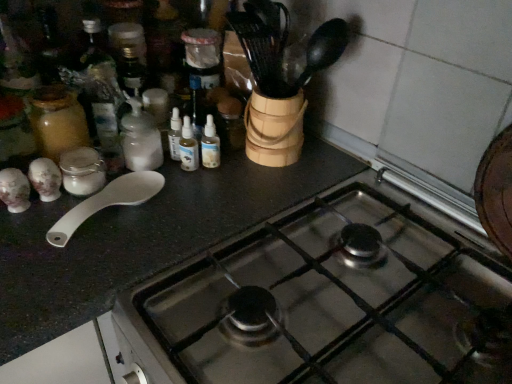
Where is `white plastic spoon at left`? This screenshot has height=384, width=512. white plastic spoon at left is located at coordinates (106, 202).

Where is `stainless steel gas stove at center`? stainless steel gas stove at center is located at coordinates (326, 304).

Is stainless steel gas stove at center positioned far away from white plastic spoon at left?

No, stainless steel gas stove at center is in close proximity to white plastic spoon at left.

From a real-world perspective, is stainless steel gas stove at center under white plastic spoon at left?

Yes.

Is stainless steel gas stove at center inside the boundaries of white plastic spoon at left, or outside?

stainless steel gas stove at center is located beyond the bounds of white plastic spoon at left.

Does stainless steel gas stove at center come behind white plastic spoon at left?

No, stainless steel gas stove at center is in front of white plastic spoon at left.

Does white plastic spoon at left have a greater width compared to stainless steel gas stove at center?

Incorrect, the width of white plastic spoon at left does not surpass that of stainless steel gas stove at center.

Is white plastic spoon at left touching stainless steel gas stove at center?

No, white plastic spoon at left is not next to stainless steel gas stove at center.

Is white plastic spoon at left completely or partially outside of stainless steel gas stove at center?

Indeed, white plastic spoon at left is completely outside stainless steel gas stove at center.

From a real-world perspective, is white plastic spoon at left on stainless steel gas stove at center?

Yes, from a real-world perspective, white plastic spoon at left is over stainless steel gas stove at center

Does stainless steel gas stove at center appear on the right side of white matte bottle at center-left?

Yes, stainless steel gas stove at center is to the right of white matte bottle at center-left.

Is stainless steel gas stove at center oriented towards white matte bottle at center-left?

No, stainless steel gas stove at center does not turn towards white matte bottle at center-left.

Is point (499, 264) farther from camera compared to point (145, 130)?

No, it is in front of (145, 130).

Considering the relative sizes of stainless steel gas stove at center and white matte bottle at center-left in the image provided, is stainless steel gas stove at center wider than white matte bottle at center-left?

Yes, stainless steel gas stove at center is wider than white matte bottle at center-left.

Can you confirm if white matte bottle at center-left is shorter than white plastic spoon at left?

Incorrect, the height of white matte bottle at center-left does not fall short of that of white plastic spoon at left.

Is white matte bottle at center-left at the left side of white plastic spoon at left?

No.

From a real-world perspective, is white matte bottle at center-left located higher than white plastic spoon at left?

Correct, in the physical world, white matte bottle at center-left is higher than white plastic spoon at left.

Is white matte bottle at center-left far away from stainless steel gas stove at center?

No, white matte bottle at center-left is in close proximity to stainless steel gas stove at center.

Where is `bottle lying on the left of stainless steel gas stove at center`? Image resolution: width=512 pixels, height=384 pixels. bottle lying on the left of stainless steel gas stove at center is located at coordinates (140, 138).

How far apart are white matte bottle at center-left and stainless steel gas stove at center?

A distance of 17.06 inches exists between white matte bottle at center-left and stainless steel gas stove at center.

Which object is positioned more to the right, white plastic spoon at left or white matte bottle at center-left?

From the viewer's perspective, white matte bottle at center-left appears more on the right side.

Is white plastic spoon at left aimed at white matte bottle at center-left?

No, white plastic spoon at left is not oriented towards white matte bottle at center-left.

Who is smaller, white plastic spoon at left or white matte bottle at center-left?

white plastic spoon at left is smaller.

Image resolution: width=512 pixels, height=384 pixels. In order to click on spoon lying behind the stainless steel gas stove at center in this screenshot , I will do `click(106, 202)`.

The image size is (512, 384). I want to click on spoon above the stainless steel gas stove at center (from a real-world perspective), so click(106, 202).

Based on their spatial positions, is stainless steel gas stove at center or white matte bottle at center-left closer to white plastic spoon at left?

white matte bottle at center-left lies closer to white plastic spoon at left than the other object.

When comparing their distances from white matte bottle at center-left, does white plastic spoon at left or stainless steel gas stove at center seem further?

The object further to white matte bottle at center-left is stainless steel gas stove at center.

When comparing their distances from stainless steel gas stove at center, does white plastic spoon at left or white matte bottle at center-left seem closer?

white plastic spoon at left lies closer to stainless steel gas stove at center than the other object.

Which object lies further to the anchor point stainless steel gas stove at center, white matte bottle at center-left or white plastic spoon at left?

white matte bottle at center-left is positioned further to the anchor stainless steel gas stove at center.

From the image, which object appears to be nearer to white matte bottle at center-left, stainless steel gas stove at center or white plastic spoon at left?

Among the two, white plastic spoon at left is located nearer to white matte bottle at center-left.

Which object lies further to the anchor point white plastic spoon at left, white matte bottle at center-left or stainless steel gas stove at center?

Among the two, stainless steel gas stove at center is located further to white plastic spoon at left.

I want to click on spoon between stainless steel gas stove at center and white matte bottle at center-left from front to back, so click(x=106, y=202).